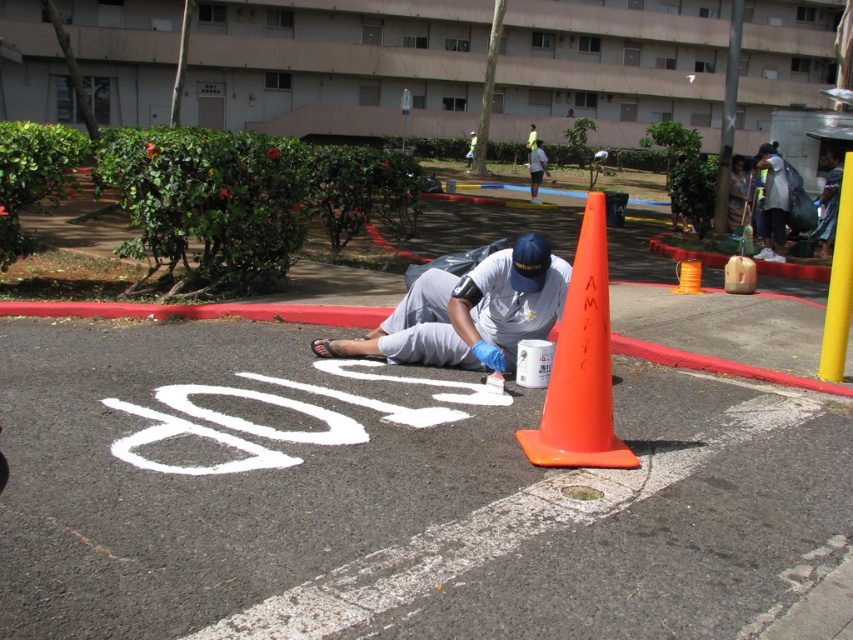
You are a surveyor trying to locate the point marked at coordinates (389, 496) in the image. According to the scene description, where would you find this point?

The point at coordinates (389, 496) is located on the white painted pavement at center.

You are a pedestrian trying to identify the worker painting road markings. Based on the scene, which shirt is positioned lower between the dark gray fabric shirt at upper right and the white matte shirt at center?

The dark gray fabric shirt at upper right is positioned below the white matte shirt at center, meaning it is lower in the image.

You are a pedestrian crossing the parking lot and see the white painted pavement at center and the orange plastic traffic cone at center. Which object is closer to you?

The white painted pavement at center is closer to the viewer than the orange plastic traffic cone at center.